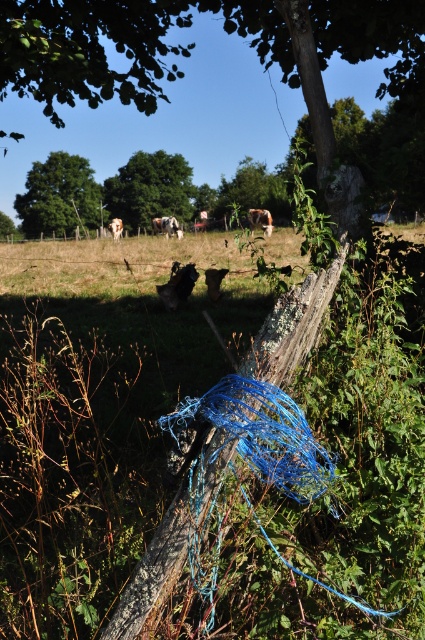
You are standing in the rural scene and want to walk towards the green leafy tree at center and the green rough bark tree at center. Which tree will you encounter first?

The green leafy tree at center is in front of the green rough bark tree at center, so you will encounter the green leafy tree at center first.

You are standing in the rural scene and want to walk from the brown furry cow at center to the green leafy tree at center. Which direction should you face to move directly towards the tree?

You should face to the right to move directly towards the green leafy tree at center from the brown furry cow at center, since the green leafy tree at center is positioned to the right of the brown furry cow at center.